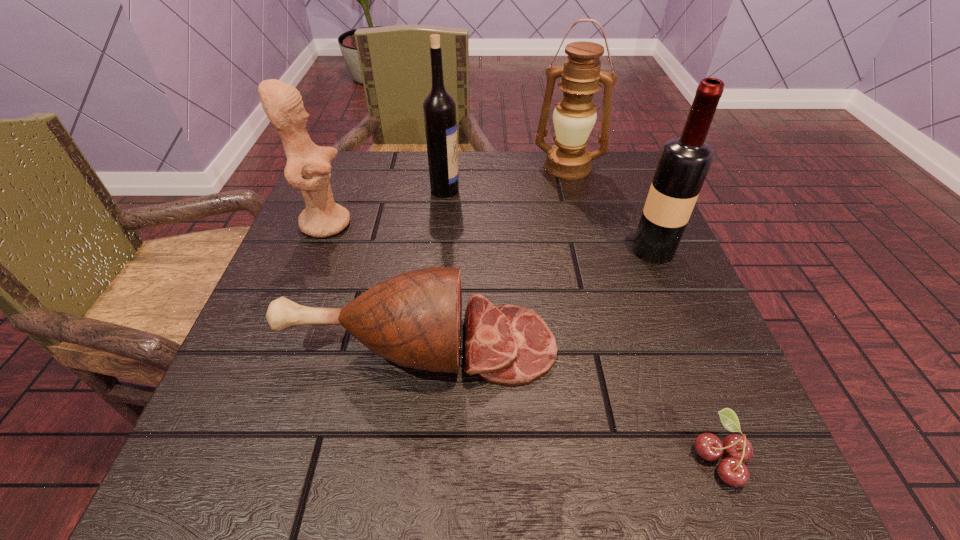
Locate an element on the screen. Image resolution: width=960 pixels, height=540 pixels. blank region between the oil lamp and the right wine bottle is located at coordinates (611, 209).

Where is `free space between the nearer wine bottle and the figurine`? The height and width of the screenshot is (540, 960). free space between the nearer wine bottle and the figurine is located at coordinates (490, 237).

Find the location of a particular element. empty space between the oil lamp and the ham is located at coordinates (494, 256).

Where is `vacant space in between the right wine bottle and the fifth farthest object`? The image size is (960, 540). vacant space in between the right wine bottle and the fifth farthest object is located at coordinates (537, 298).

Find the location of a particular element. This screenshot has height=540, width=960. object that is the fourth closest to the cherry is located at coordinates (439, 108).

Identify which object is the third closest to the second farthest object. Please provide its 2D coordinates. Your answer should be formatted as a tuple, i.e. [(x, y)], where the tuple contains the x and y coordinates of a point satisfying the conditions above.

[(413, 319)]

Identify the location of blank space that satisfies the following two spatial constraints: 1. on the front side of the right wine bottle; 2. at the sliced end of the fifth farthest object. This screenshot has width=960, height=540. (693, 346).